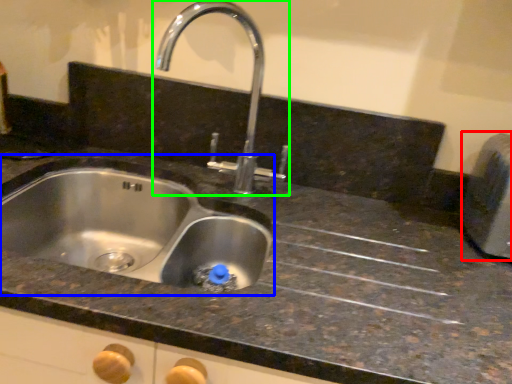
Question: Considering the real-world distances, which object is closest to appliance (highlighted by a red box)? sink (highlighted by a blue box) or tap (highlighted by a green box).

Choices:
 (A) sink
 (B) tap

Answer: (B)